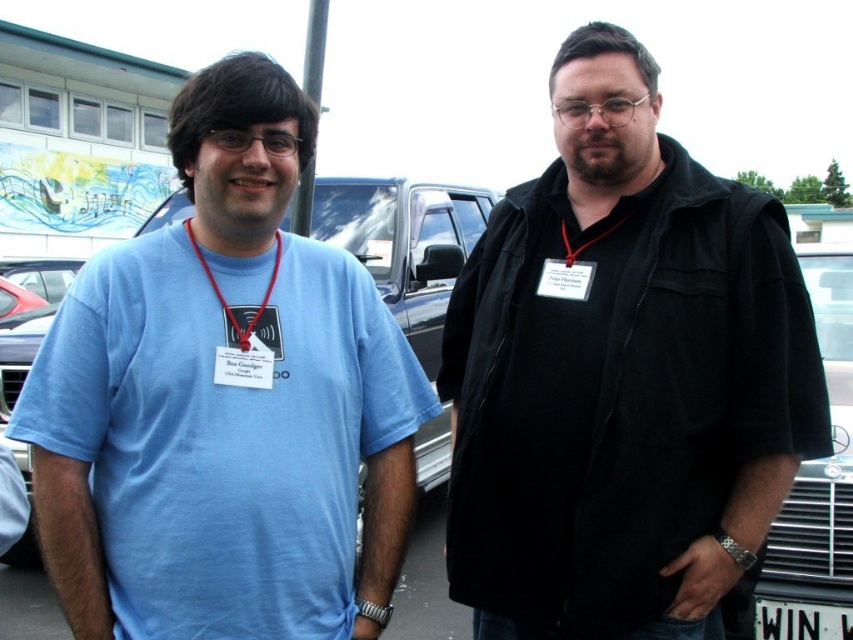
Question: Based on their relative distances, which object is nearer to the black fabric at center?

Choices:
 (A) black matte jacket at center
 (B) red fabric lanyard at center
 (C) red leather lanyard at center
 (D) matte blue t-shirt at left

Answer: (B)

Question: Which object is farther from the camera taking this photo?

Choices:
 (A) black fabric at center
 (B) matte blue t-shirt at left
 (C) white plastic license plate at lower right

Answer: (C)

Question: Among these objects, which one is farthest from the camera?

Choices:
 (A) matte blue shirt at center
 (B) black fabric at center

Answer: (B)

Question: Can you confirm if black matte jacket at center is positioned to the left of matte blue shirt at center?

Choices:
 (A) no
 (B) yes

Answer: (A)

Question: Is black matte jacket at center positioned before white plastic license plate at lower right?

Choices:
 (A) yes
 (B) no

Answer: (A)

Question: Is black matte jacket at center positioned in front of matte blue t-shirt at left?

Choices:
 (A) yes
 (B) no

Answer: (B)